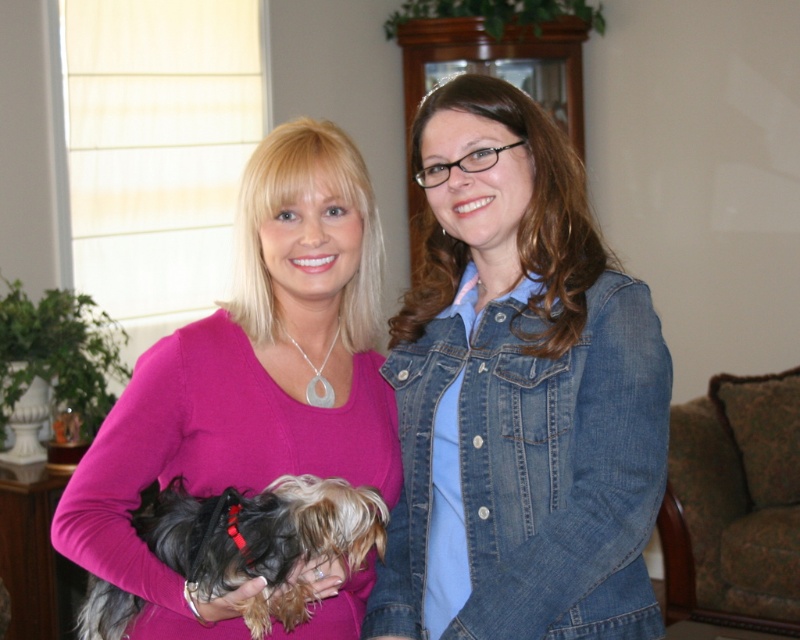
You are a photographer setting up a shoot in this indoor scene. You need to position a small stool to the left of the fluffy brown dog at center so that it doesn not block the green floral fabric armchair at lower right. Where should you place the stool?

The green floral fabric armchair at lower right is to the right of the fluffy brown dog at center. To place the stool to the left of the fluffy brown dog at center without blocking the armchair, position the stool to the left side of the dog, ensuring it stays away from the armchair which is already on the dog s right side.

You are a photographer setting up for a photo shoot. You need to ensure that the denim jacket at center and the fluffy brown dog at center are both visible in the frame. Based on their positions, which object should you focus on first to ensure both are in focus?

The denim jacket at center is above the fluffy brown dog at center, so focusing on the denim jacket at center first would ensure both are in focus since it is higher up and can help adjust the depth of field accordingly.